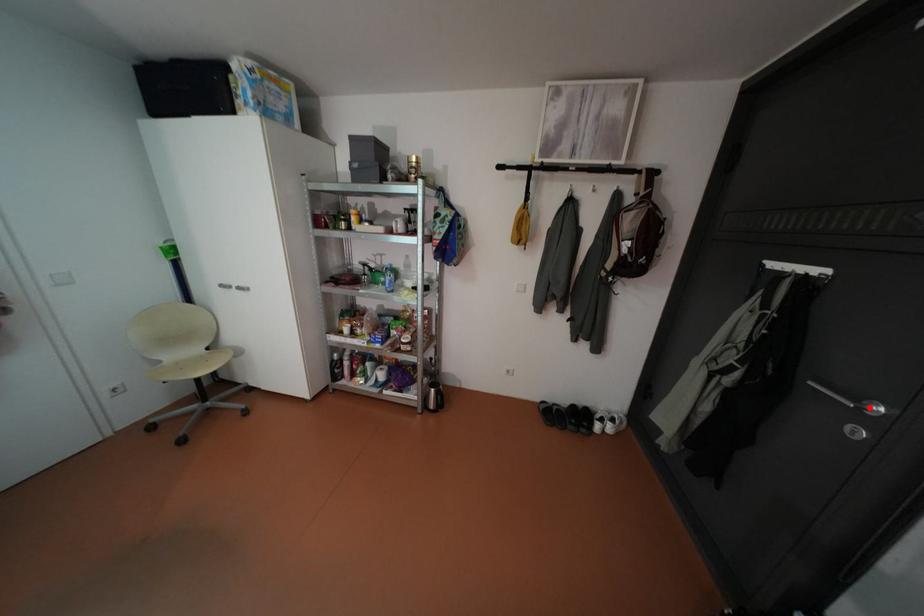
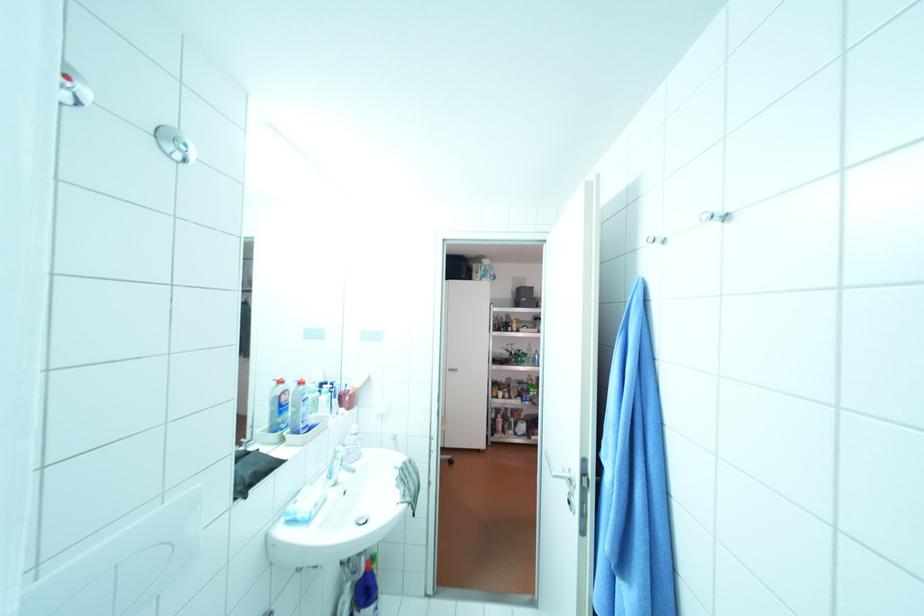
Question: I am providing you with two images of the same scene from different viewpoints. A red point is marked on the first image. Is the red point's position out of view in image 2?

Choices:
 (A) Yes
 (B) No

Answer: (A)